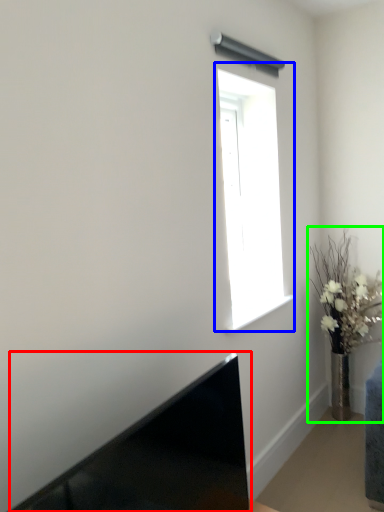
Question: Which object is positioned closest to laptop (highlighted by a red box)? Select from window (highlighted by a blue box) and houseplant (highlighted by a green box).

Choices:
 (A) window
 (B) houseplant

Answer: (A)